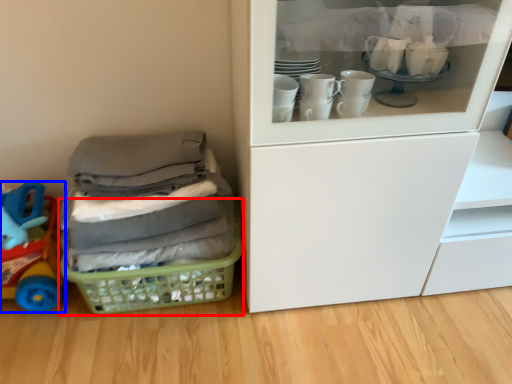
Question: Among these objects, which one is nearest to the camera, basket (highlighted by a red box) or toy (highlighted by a blue box)?

Choices:
 (A) basket
 (B) toy

Answer: (B)